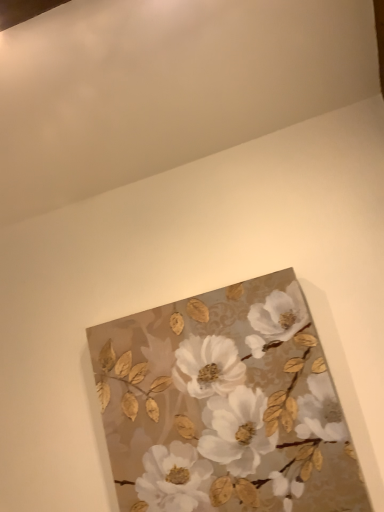
Question: Should I look upward or downward to see gold textured leaves and flowers at center?

Choices:
 (A) down
 (B) up

Answer: (A)